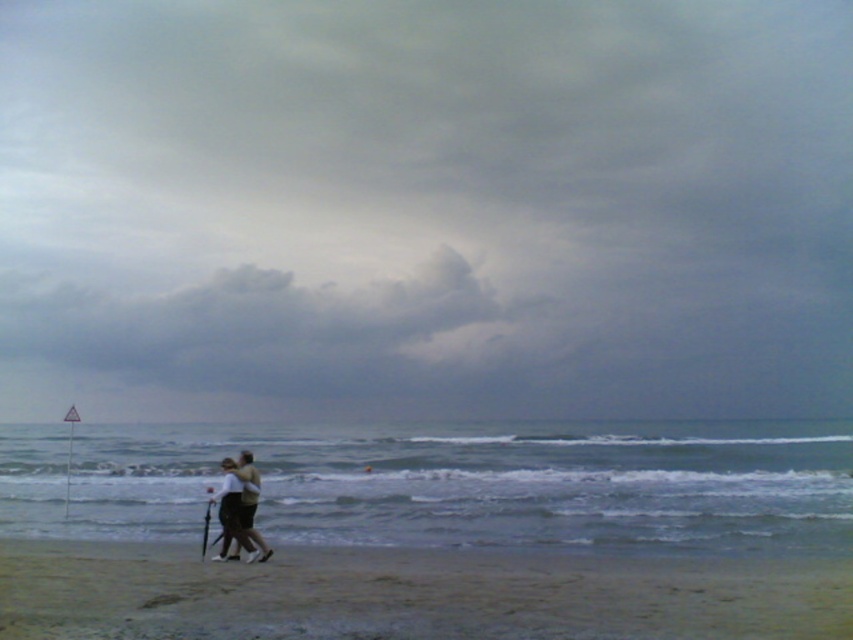
You are a photographer trying to capture the gray cloudy sky at upper center in your shot. You are currently standing at the position indicated by point (x=425, y=209). Can you confirm if the gray cloudy sky at upper center is directly above you?

The gray cloudy sky at upper center is located at point (x=425, y=209), so yes, it is directly above you.

You are standing on the beach and see the sandy at lower center and the light brown fabric couple at center. Which object is positioned to the right side?

The sandy at lower center is positioned to the right of the light brown fabric couple at center.